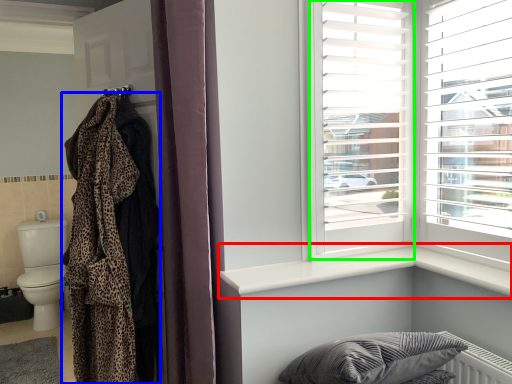
Question: Which object is the farthest from window sill (highlighted by a red box)? Choose among these: blanket (highlighted by a blue box) or window frame (highlighted by a green box).

Choices:
 (A) blanket
 (B) window frame

Answer: (A)